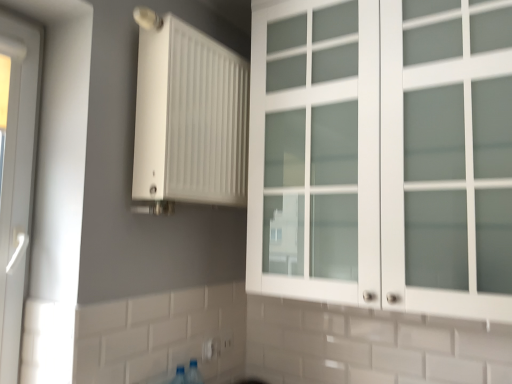
How much space does white plastic electric outlet at lower center, which appears as the 2th electric outlet when viewed from the back, occupy horizontally?

The width of white plastic electric outlet at lower center, which appears as the 2th electric outlet when viewed from the back, is 0.40 inches.

You are a GUI agent. You are given a task and a screenshot of the screen. Output one action in this format:
    pyautogui.click(x=<x>, y=<y>)
    Task: Click on the white matte radiator at upper center
    The height and width of the screenshot is (384, 512).
    Given the screenshot: What is the action you would take?
    pyautogui.click(x=189, y=119)

From the image's perspective, which is below, white plastic door at left or white plastic electric outlet at lower center, the first electric outlet in the front-to-back sequence?

white plastic electric outlet at lower center, the first electric outlet in the front-to-back sequence, from the image's perspective.

Which is more to the right, white plastic door at left or white plastic electric outlet at lower center, acting as the 2th electric outlet starting from the right?

Positioned to the right is white plastic electric outlet at lower center, acting as the 2th electric outlet starting from the right.

Based on the photo, from a real-world perspective, between white plastic door at left and white plastic electric outlet at lower center, arranged as the 1th electric outlet when viewed from the left, who is vertically lower?

In real-world perspective, white plastic electric outlet at lower center, arranged as the 1th electric outlet when viewed from the left, is lower.

Is point (291, 272) less distant than point (1, 353)?

That is False.

Who is taller, white frosted glass cabinet at upper right or white plastic door at left?

Standing taller between the two is white frosted glass cabinet at upper right.

Is white frosted glass cabinet at upper right in front of or behind white plastic door at left in the image?

In the image, white frosted glass cabinet at upper right appears in front of white plastic door at left.

From a real-world perspective, is white plastic electric outlet at lower center, arranged as the 1th electric outlet when viewed from the left, above or below white plastic door at left?

white plastic electric outlet at lower center, arranged as the 1th electric outlet when viewed from the left, is situated lower than white plastic door at left in the real world.

Between white plastic electric outlet at lower center, which appears as the 2th electric outlet when viewed from the back, and white plastic door at left, which one has smaller size?

white plastic electric outlet at lower center, which appears as the 2th electric outlet when viewed from the back.

Is white plastic electric outlet at lower center, arranged as the 1th electric outlet when viewed from the left, far from white plastic door at left?

No, white plastic electric outlet at lower center, arranged as the 1th electric outlet when viewed from the left, is not far away from white plastic door at left.

This screenshot has width=512, height=384. Identify the location of door above the white plastic electric outlet at lower center, the first electric outlet in the front-to-back sequence (from the image's perspective). (17, 180).

Is white plastic electric outlet at lower center, which is the 2th electric outlet in front-to-back order, inside the boundaries of white plastic electric outlet at lower center, which appears as the 2th electric outlet when viewed from the back, or outside?

white plastic electric outlet at lower center, which is the 2th electric outlet in front-to-back order, exists outside the volume of white plastic electric outlet at lower center, which appears as the 2th electric outlet when viewed from the back.

Can you confirm if white plastic electric outlet at lower center, marked as the 1th electric outlet in a right-to-left arrangement, is bigger than white plastic electric outlet at lower center, which appears as the 2th electric outlet when viewed from the back?

Indeed, white plastic electric outlet at lower center, marked as the 1th electric outlet in a right-to-left arrangement, has a larger size compared to white plastic electric outlet at lower center, which appears as the 2th electric outlet when viewed from the back.

Can you confirm if white plastic electric outlet at lower center, marked as the 1th electric outlet in a back-to-front arrangement, is positioned to the right of white plastic electric outlet at lower center, the first electric outlet in the front-to-back sequence?

Indeed, white plastic electric outlet at lower center, marked as the 1th electric outlet in a back-to-front arrangement, is positioned on the right side of white plastic electric outlet at lower center, the first electric outlet in the front-to-back sequence.

Considering their positions, is white plastic electric outlet at lower center, the 2th electric outlet from the left, located in front of or behind white plastic electric outlet at lower center, arranged as the 1th electric outlet when viewed from the left?

Clearly, white plastic electric outlet at lower center, the 2th electric outlet from the left, is behind white plastic electric outlet at lower center, arranged as the 1th electric outlet when viewed from the left.

From a real-world perspective, is white plastic electric outlet at lower center, acting as the 2th electric outlet starting from the right, above or below white plastic electric outlet at lower center, which is the 2th electric outlet in front-to-back order?

white plastic electric outlet at lower center, acting as the 2th electric outlet starting from the right, is situated higher than white plastic electric outlet at lower center, which is the 2th electric outlet in front-to-back order, in the real world.

Between white plastic electric outlet at lower center, acting as the 2th electric outlet starting from the right, and white plastic electric outlet at lower center, which is the 2th electric outlet in front-to-back order, which one appears on the right side from the viewer's perspective?

Answer: white plastic electric outlet at lower center, which is the 2th electric outlet in front-to-back order.

Does white plastic electric outlet at lower center, acting as the 2th electric outlet starting from the right, have a larger size compared to white plastic electric outlet at lower center, the 2th electric outlet from the left?

No.

Does white plastic electric outlet at lower center, arranged as the 1th electric outlet when viewed from the left, turn towards white plastic electric outlet at lower center, the 2th electric outlet from the left?

No, white plastic electric outlet at lower center, arranged as the 1th electric outlet when viewed from the left, is not oriented towards white plastic electric outlet at lower center, the 2th electric outlet from the left.

Would you say white matte radiator at upper center is outside white frosted glass cabinet at upper right?

That's correct, white matte radiator at upper center is outside of white frosted glass cabinet at upper right.

How different are the orientations of white matte radiator at upper center and white frosted glass cabinet at upper right in degrees?

white matte radiator at upper center and white frosted glass cabinet at upper right are facing 88.3 degrees away from each other.

From a real-world perspective, between white matte radiator at upper center and white frosted glass cabinet at upper right, who is vertically higher?

In real-world perspective, white matte radiator at upper center is above.

Considering the sizes of objects white matte radiator at upper center and white frosted glass cabinet at upper right in the image provided, who is bigger, white matte radiator at upper center or white frosted glass cabinet at upper right?

white frosted glass cabinet at upper right is bigger.

From the image's perspective, is white frosted glass cabinet at upper right positioned above or below white plastic electric outlet at lower center, marked as the 1th electric outlet in a back-to-front arrangement?

white frosted glass cabinet at upper right is situated higher than white plastic electric outlet at lower center, marked as the 1th electric outlet in a back-to-front arrangement, in the image.

Considering the relative sizes of white frosted glass cabinet at upper right and white plastic electric outlet at lower center, marked as the 1th electric outlet in a right-to-left arrangement, in the image provided, is white frosted glass cabinet at upper right shorter than white plastic electric outlet at lower center, marked as the 1th electric outlet in a right-to-left arrangement,?

Incorrect, the height of white frosted glass cabinet at upper right does not fall short of that of white plastic electric outlet at lower center, marked as the 1th electric outlet in a right-to-left arrangement.

Choose the correct answer: Is white frosted glass cabinet at upper right inside white plastic electric outlet at lower center, which is the 2th electric outlet in front-to-back order, or outside it?

white frosted glass cabinet at upper right is not enclosed by white plastic electric outlet at lower center, which is the 2th electric outlet in front-to-back order.

Considering the sizes of objects white frosted glass cabinet at upper right and white plastic electric outlet at lower center, marked as the 1th electric outlet in a right-to-left arrangement, in the image provided, who is thinner, white frosted glass cabinet at upper right or white plastic electric outlet at lower center, marked as the 1th electric outlet in a right-to-left arrangement,?

Thinner between the two is white plastic electric outlet at lower center, marked as the 1th electric outlet in a right-to-left arrangement.

The width and height of the screenshot is (512, 384). In order to click on door above the white plastic electric outlet at lower center, acting as the 2th electric outlet starting from the right (from the image's perspective) in this screenshot , I will do `click(17, 180)`.

Where is `door on the left side of white frosted glass cabinet at upper right`? This screenshot has height=384, width=512. door on the left side of white frosted glass cabinet at upper right is located at coordinates (17, 180).

Estimate the real-world distances between objects in this image. Which object is further from white plastic electric outlet at lower center, the first electric outlet in the front-to-back sequence, white plastic door at left or white frosted glass cabinet at upper right?

Based on the image, white frosted glass cabinet at upper right appears to be further to white plastic electric outlet at lower center, the first electric outlet in the front-to-back sequence.

From the image, which object appears to be nearer to white plastic door at left, white frosted glass cabinet at upper right or white plastic electric outlet at lower center, the 2th electric outlet from the left?

Among the two, white plastic electric outlet at lower center, the 2th electric outlet from the left, is located nearer to white plastic door at left.

Considering their positions, is white plastic door at left positioned further to white frosted glass cabinet at upper right than white plastic electric outlet at lower center, marked as the 1th electric outlet in a right-to-left arrangement?

white plastic door at left lies further to white frosted glass cabinet at upper right than the other object.

Estimate the real-world distances between objects in this image. Which object is further from white frosted glass cabinet at upper right, white plastic electric outlet at lower center, the 2th electric outlet from the left, or white matte radiator at upper center?

white plastic electric outlet at lower center, the 2th electric outlet from the left, is positioned further to the anchor white frosted glass cabinet at upper right.

Looking at the image, which one is located closer to white plastic door at left, white plastic electric outlet at lower center, arranged as the 1th electric outlet when viewed from the left, or white matte radiator at upper center?

Based on the image, white matte radiator at upper center appears to be nearer to white plastic door at left.

Based on their spatial positions, is white plastic electric outlet at lower center, marked as the 1th electric outlet in a right-to-left arrangement, or white frosted glass cabinet at upper right further from white plastic electric outlet at lower center, arranged as the 1th electric outlet when viewed from the left?

white frosted glass cabinet at upper right is positioned further to the anchor white plastic electric outlet at lower center, arranged as the 1th electric outlet when viewed from the left.

Considering their positions, is white matte radiator at upper center positioned further to white plastic electric outlet at lower center, marked as the 1th electric outlet in a right-to-left arrangement, than white plastic electric outlet at lower center, arranged as the 1th electric outlet when viewed from the left?

white matte radiator at upper center lies further to white plastic electric outlet at lower center, marked as the 1th electric outlet in a right-to-left arrangement, than the other object.

Consider the image. Estimate the real-world distances between objects in this image. Which object is further from white plastic electric outlet at lower center, the 2th electric outlet from the left, white matte radiator at upper center or white plastic door at left?

white plastic door at left lies further to white plastic electric outlet at lower center, the 2th electric outlet from the left, than the other object.

Find the location of a particular element. door between white matte radiator at upper center and white plastic electric outlet at lower center, marked as the 1th electric outlet in a right-to-left arrangement, from top to bottom is located at coordinates (17, 180).

Identify the location of cupboard between white matte radiator at upper center and white plastic electric outlet at lower center, acting as the 2th electric outlet starting from the right, vertically. (383, 155).

This screenshot has height=384, width=512. Identify the location of electric outlet between white plastic door at left and white plastic electric outlet at lower center, which is the 2th electric outlet in front-to-back order, from left to right. (210, 349).

What are the coordinates of `radiator between white plastic door at left and white frosted glass cabinet at upper right in the horizontal direction` in the screenshot? It's located at (189, 119).